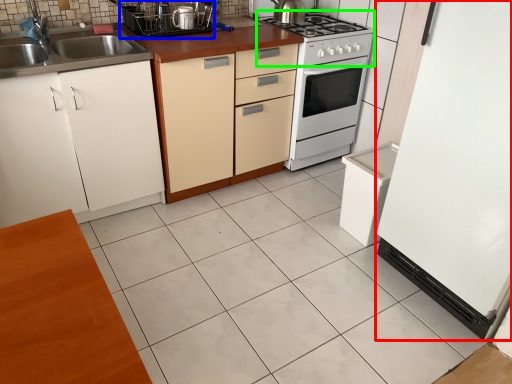
Question: Considering the real-world distances, which object is farthest from appliance (highlighted by a red box)? appliance (highlighted by a blue box) or gas stove (highlighted by a green box)?

Choices:
 (A) appliance
 (B) gas stove

Answer: (A)